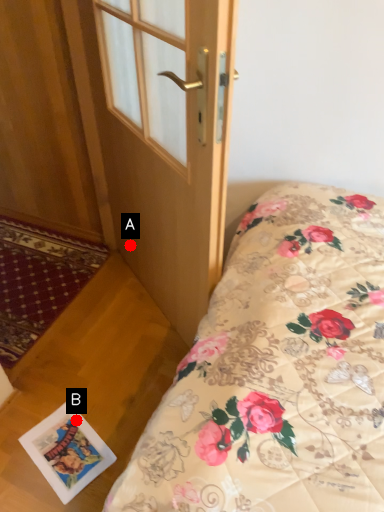
Question: Two points are circled on the image, labeled by A and B beside each circle. Which point appears closest to the camera in this image?

Choices:
 (A) A is closer
 (B) B is closer

Answer: (B)